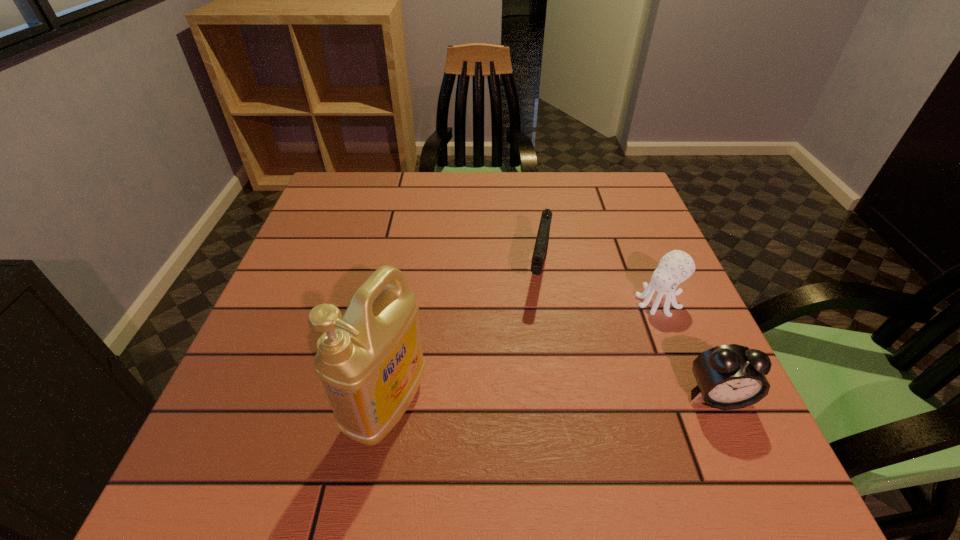
Image resolution: width=960 pixels, height=540 pixels. I want to click on the leftmost object, so pos(370,361).

You are a GUI agent. You are given a task and a screenshot of the screen. Output one action in this format:
    pyautogui.click(x=<x>, y=<y>)
    Task: Click on the tallest object
    This screenshot has width=960, height=540.
    Given the screenshot: What is the action you would take?
    pyautogui.click(x=370, y=361)

Identify the location of alarm clock. (732, 376).

You are a GUI agent. You are given a task and a screenshot of the screen. Output one action in this format:
    pyautogui.click(x=<x>, y=<y>)
    Task: Click on the pistol
    The width and height of the screenshot is (960, 540).
    Given the screenshot: What is the action you would take?
    pyautogui.click(x=541, y=245)

Where is `octopus`? octopus is located at coordinates (675, 267).

Where is `free point located on the right of the detergent`? The height and width of the screenshot is (540, 960). free point located on the right of the detergent is located at coordinates (504, 406).

The image size is (960, 540). What are the coordinates of `free space located at the barrel of the pistol` in the screenshot? It's located at (531, 345).

The width and height of the screenshot is (960, 540). I want to click on free space located 0.310m at the barrel of the pistol, so click(516, 427).

Where is `vacant space positioned 0.110m at the barrel of the pistol`? This screenshot has height=540, width=960. vacant space positioned 0.110m at the barrel of the pistol is located at coordinates (532, 338).

Locate an element on the screen. This screenshot has height=540, width=960. free location located on the front-facing side of the octopus is located at coordinates (615, 336).